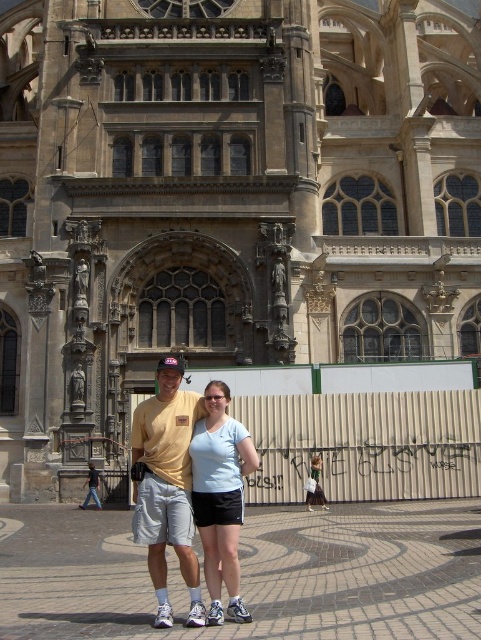
Question: Does yellow t-shirt at center have a smaller size compared to light blue fabric shirt at center?

Choices:
 (A) no
 (B) yes

Answer: (A)

Question: Does yellow t-shirt at center appear on the right side of light blue fabric shirt at center?

Choices:
 (A) no
 (B) yes

Answer: (A)

Question: Does yellow t-shirt at center have a larger size compared to light blue fabric shirt at center?

Choices:
 (A) no
 (B) yes

Answer: (B)